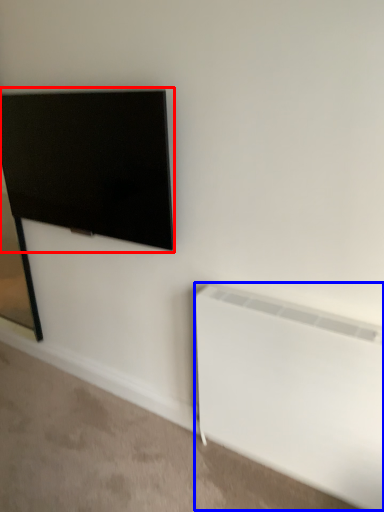
Question: Which object is further to the camera taking this photo, television (highlighted by a red box) or radiator (highlighted by a blue box)?

Choices:
 (A) television
 (B) radiator

Answer: (A)